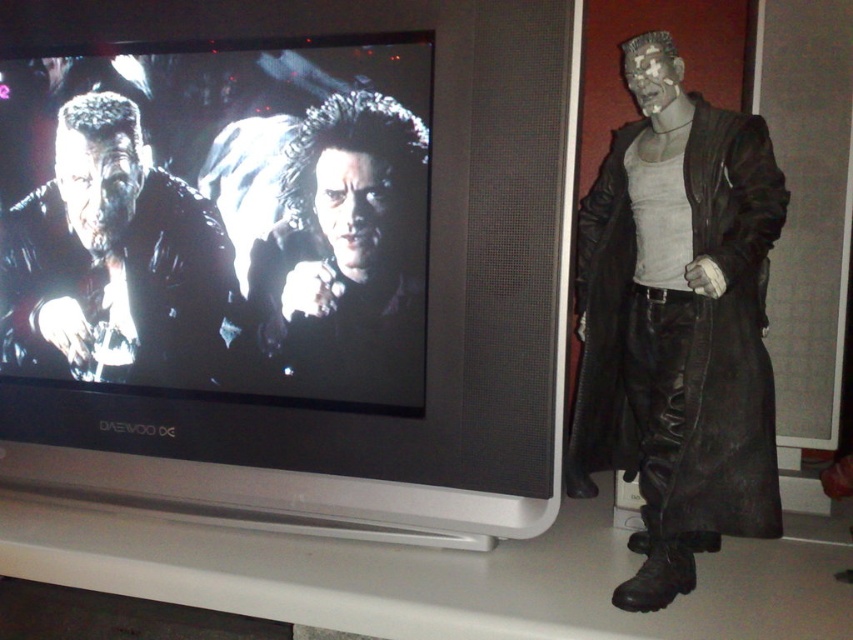
Question: Considering the real-world distances, which object is closest to the matte black coat at right?

Choices:
 (A) shiny black hair at center
 (B) matte black leather jacket at left
 (C) matte black television at center

Answer: (C)

Question: Is matte black television at center thinner than shiny black hair at center?

Choices:
 (A) no
 (B) yes

Answer: (A)

Question: Estimate the real-world distances between objects in this image. Which object is closer to the matte black television at center?

Choices:
 (A) matte black leather jacket at left
 (B) shiny black hair at center
 (C) matte black coat at right

Answer: (B)

Question: Where is matte black coat at right located in relation to shiny black hair at center in the image?

Choices:
 (A) right
 (B) left

Answer: (A)

Question: Can you confirm if matte black leather jacket at left is thinner than shiny black hair at center?

Choices:
 (A) no
 (B) yes

Answer: (A)

Question: Estimate the real-world distances between objects in this image. Which object is closer to the matte black leather jacket at left?

Choices:
 (A) matte black coat at right
 (B) shiny black hair at center
 (C) matte black television at center

Answer: (C)